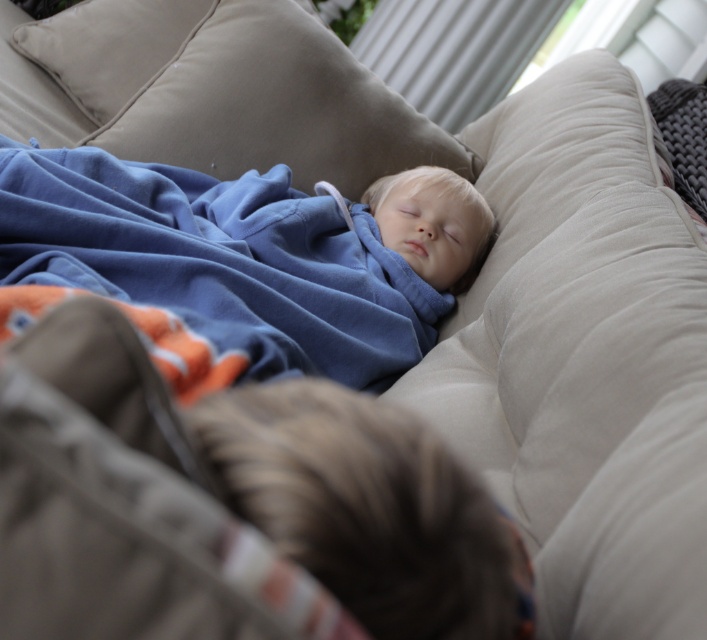
You are taking a photo of two children on a couch. The first child is at point (x=267, y=44) and the second is at point (x=21, y=26). Which child is in focus if the camera is focused on the first child?

The first child at point (x=267, y=44) is in focus because the camera is focused on them, and they are closer to the camera than the second child at point (x=21, y=26).

In the scene shown: You are a photographer trying to capture the best shot of the two children on the beige couch. You notice a specific point at coordinates point [233,92]. Where exactly is this point located in relation to the beige fabric pillow at upper center?

The point [233,92] is located on the beige fabric pillow at upper center.